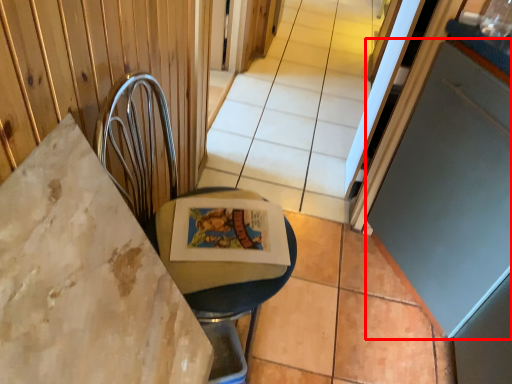
Question: In this image, where is screen door (annotated by the red box) located relative to swivel chair?

Choices:
 (A) left
 (B) right

Answer: (B)